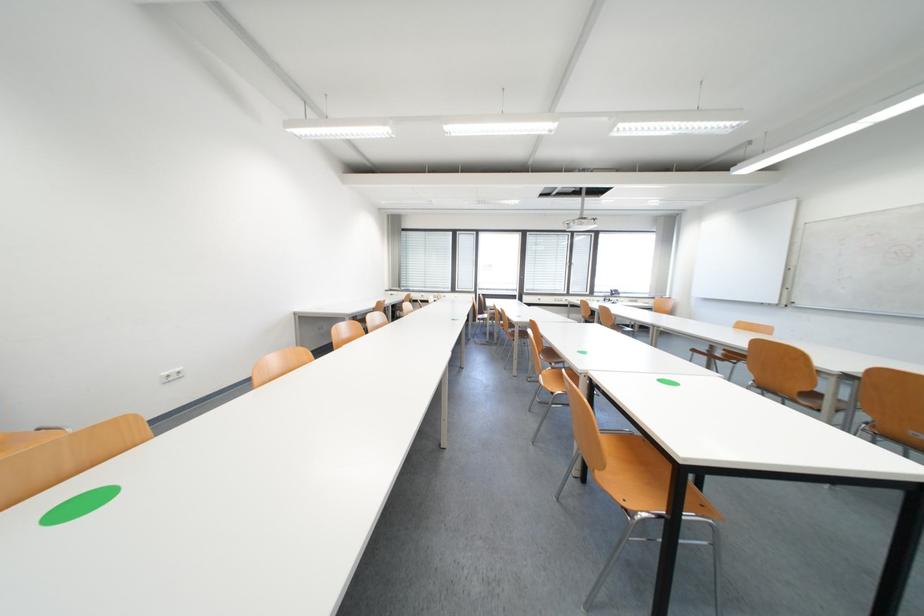
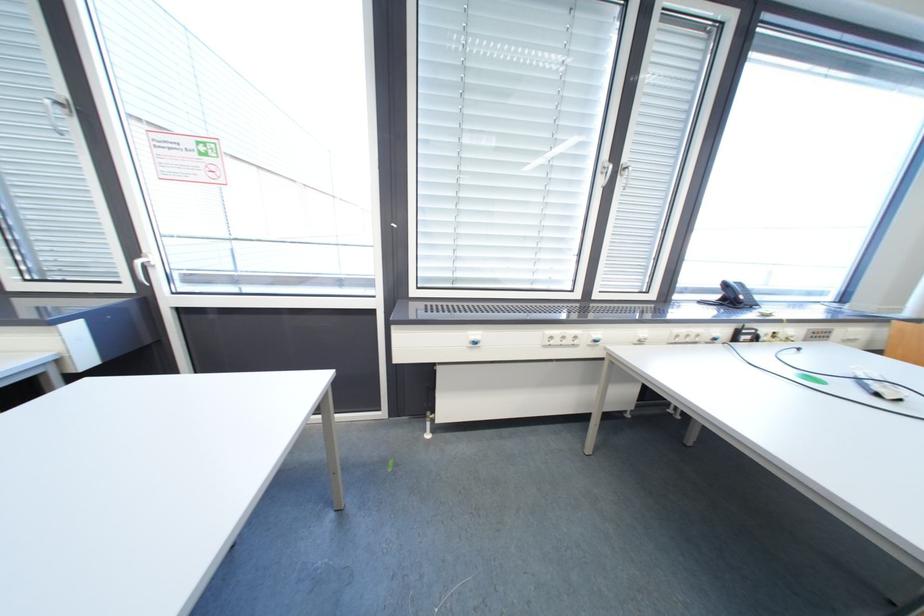
In the second image, find the point that corresponds to (x=544, y=299) in the first image.

(480, 334)